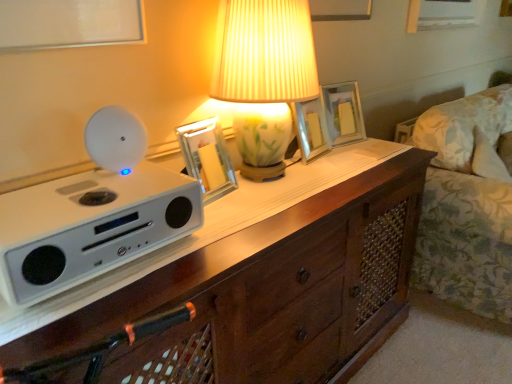
Image resolution: width=512 pixels, height=384 pixels. In order to click on free space to the right of metallic silver picture frame at center, the third picture frame from the right in this screenshot , I will do `click(263, 193)`.